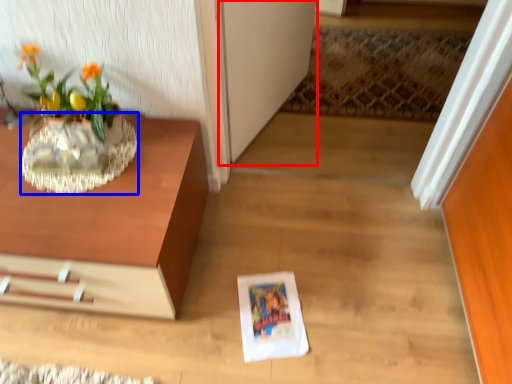
Question: Which object is further to the camera taking this photo, glass door (highlighted by a red box) or vase (highlighted by a blue box)?

Choices:
 (A) glass door
 (B) vase

Answer: (A)